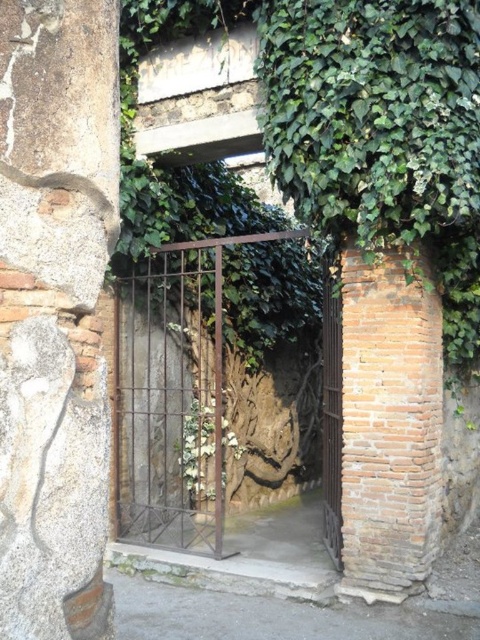
Question: Which point appears farthest from the camera in this image?

Choices:
 (A) (211, 436)
 (B) (331, 436)

Answer: (A)

Question: Which object appears farthest from the camera in this image?

Choices:
 (A) green leafy plant at center
 (B) brown wrought iron gate at center

Answer: (A)

Question: Is brown wrought iron gate at center further to the viewer compared to rusty metal gate at center?

Choices:
 (A) no
 (B) yes

Answer: (B)

Question: Does brown wrought iron gate at center come behind green leafy plant at center?

Choices:
 (A) yes
 (B) no

Answer: (B)

Question: Which point appears closest to the camera in this image?

Choices:
 (A) (339, 435)
 (B) (187, 458)
 (C) (192, 456)

Answer: (A)

Question: Observing the image, what is the correct spatial positioning of brown wrought iron gate at center in reference to green leafy plant at center?

Choices:
 (A) above
 (B) below

Answer: (A)